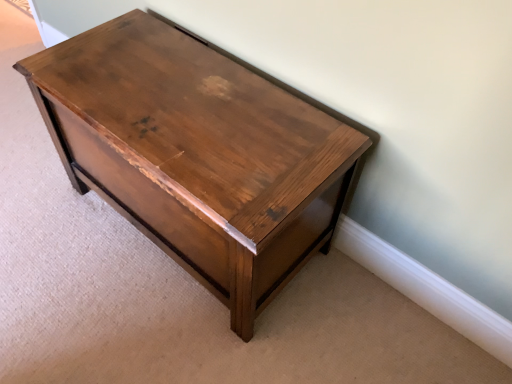
Where is `vacant area that is in front of shiny brown wood chest at center`? The height and width of the screenshot is (384, 512). vacant area that is in front of shiny brown wood chest at center is located at coordinates (x=160, y=329).